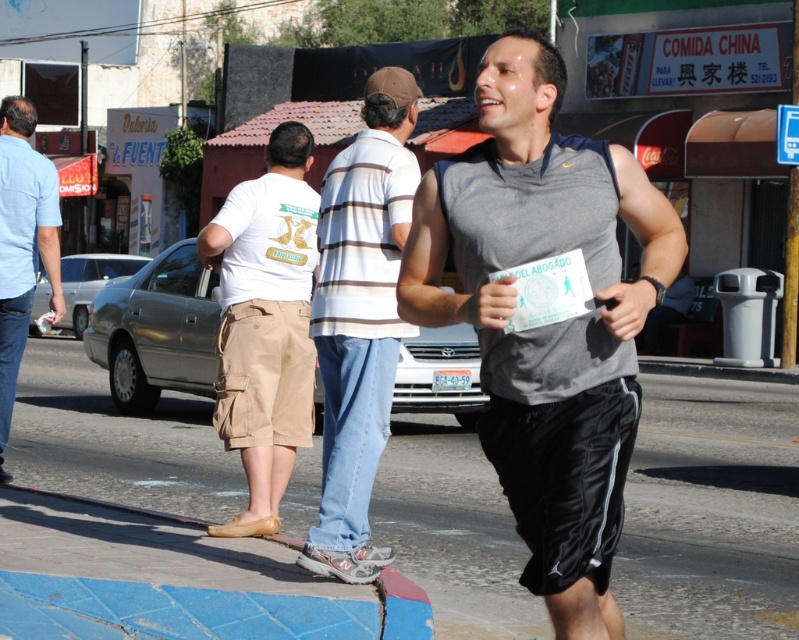
Question: Which object appears closest to the camera in this image?

Choices:
 (A) blue denim jeans at left
 (B) gray fabric tank top at center
 (C) blue concrete sidewalk at lower center
 (D) tan cargo shorts at center

Answer: (B)

Question: Is gray fabric tank top at center wider than tan cargo shorts at center?

Choices:
 (A) yes
 (B) no

Answer: (A)

Question: Is striped cotton shirt at center above tan cargo shorts at center?

Choices:
 (A) no
 (B) yes

Answer: (B)

Question: Is gray fabric tank top at center closer to the viewer compared to tan cargo shorts at center?

Choices:
 (A) yes
 (B) no

Answer: (A)

Question: Which object is the farthest from the striped cotton shirt at center?

Choices:
 (A) tan cargo shorts at center
 (B) gray fabric tank top at center
 (C) blue concrete sidewalk at lower center

Answer: (C)

Question: Which object is the closest to the gray fabric tank top at center?

Choices:
 (A) striped cotton shirt at center
 (B) blue denim jeans at left

Answer: (A)